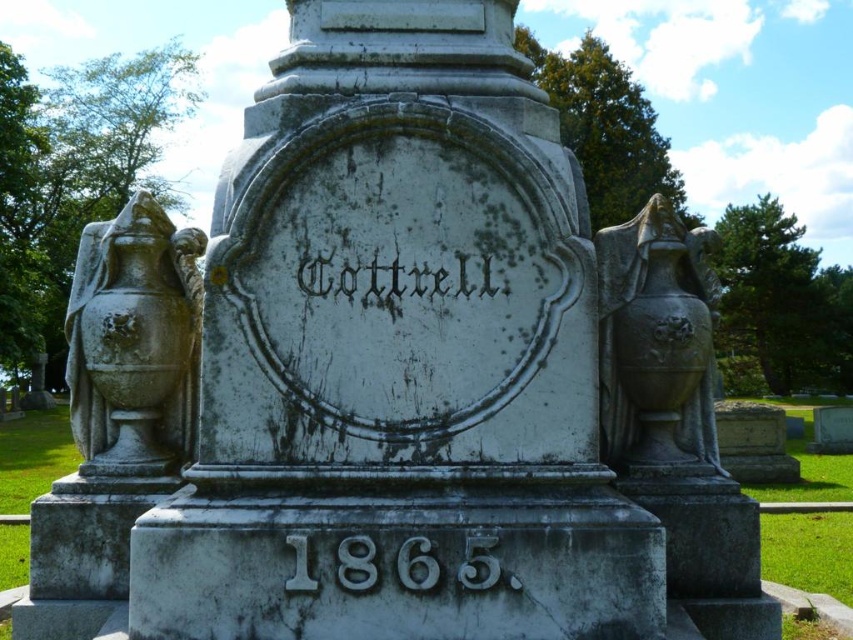
Is point (184, 406) positioned after point (351, 278)?

Yes, it is behind point (351, 278).

From the picture: Does gray stone urn at left come in front of black stone text at center?

No, it is not.

I want to click on gray stone urn at left, so click(134, 342).

At what (x,y) coordinates should I click in order to perform the action: click on gray stone urn at left. Please return your answer as a coordinate pair (x, y). The height and width of the screenshot is (640, 853). Looking at the image, I should click on (134, 342).

Between gray stone urn at right and black stone text at center, which one appears on the left side from the viewer's perspective?

Positioned to the left is black stone text at center.

Can you confirm if gray stone urn at right is shorter than black stone text at center?

No, gray stone urn at right is not shorter than black stone text at center.

Who is more forward, (694, 464) or (488, 275)?

Point (488, 275) is in front.

Where is `gray stone urn at right`? gray stone urn at right is located at coordinates (656, 340).

Is point (409, 548) closer to viewer compared to point (463, 262)?

Yes, point (409, 548) is in front of point (463, 262).

Who is more forward, (485, 584) or (317, 262)?

Point (485, 584) is more forward.

Identify the location of gray stone/texture year at lower center. This screenshot has height=640, width=853. (483, 564).

Where is `gray stone/texture year at lower center`? gray stone/texture year at lower center is located at coordinates (483, 564).